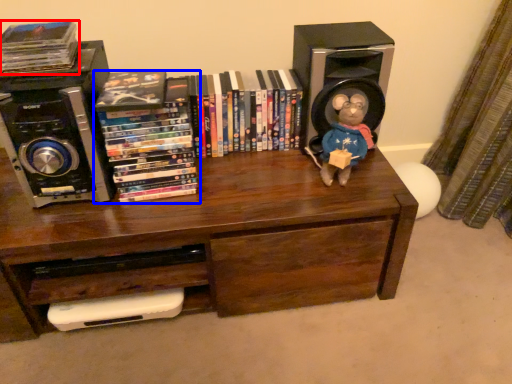
Question: Which of the following is the farthest to the observer, book (highlighted by a red box) or book (highlighted by a blue box)?

Choices:
 (A) book
 (B) book

Answer: (B)